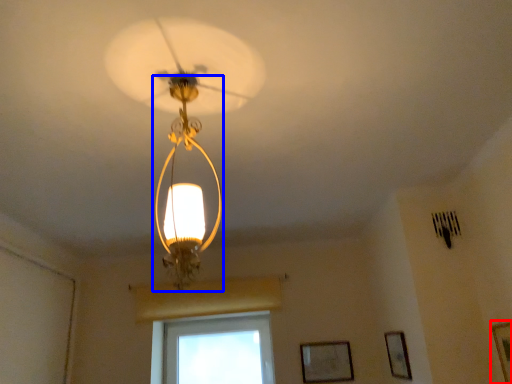
Question: Which object appears closest to the camera in this image, picture frame (highlighted by a red box) or light fixture (highlighted by a blue box)?

Choices:
 (A) picture frame
 (B) light fixture

Answer: (B)